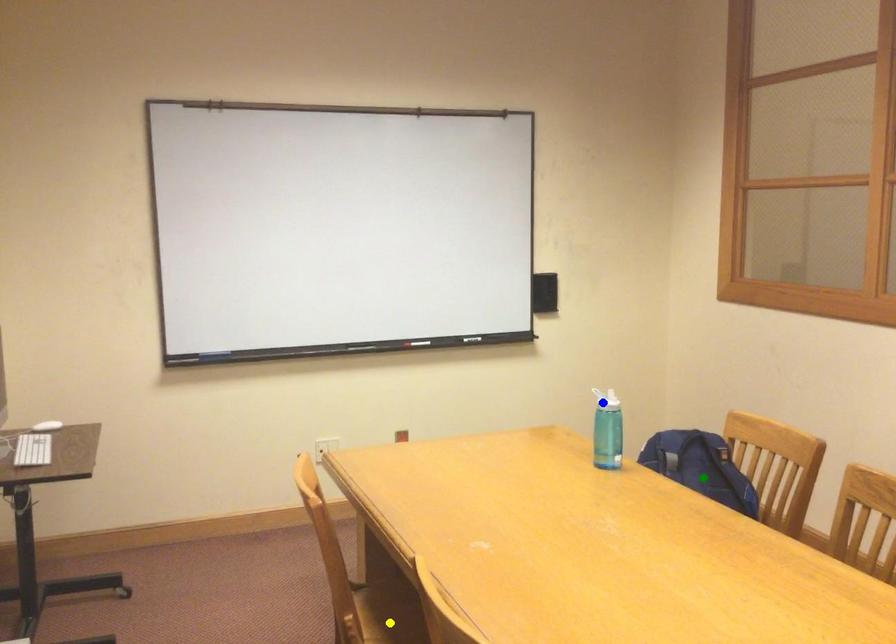
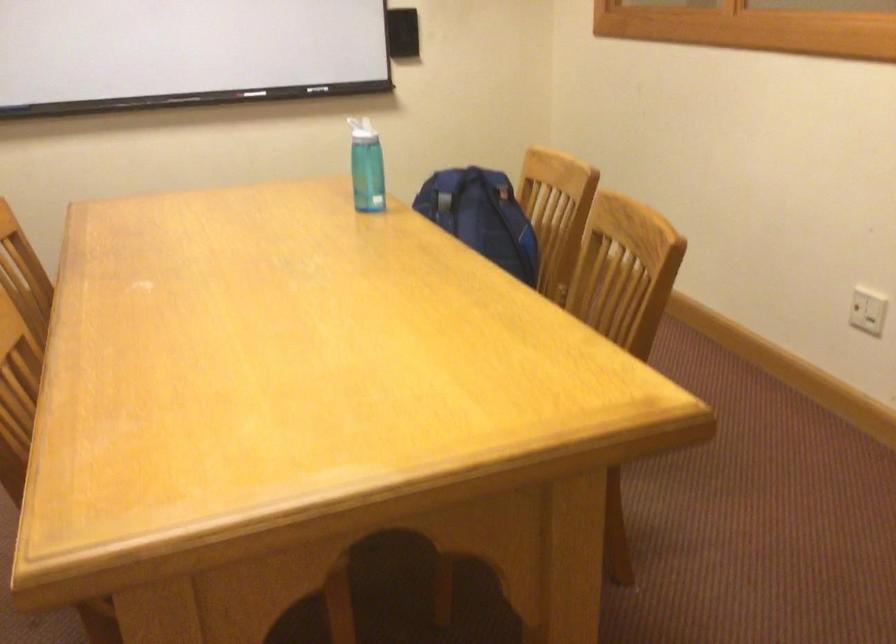
I am providing you with two images of the same scene from different viewpoints. Three points are marked in image1. Which point corresponds to a part or object that is occluded in image2?In image1, three points are marked. Which of them correspond to a part or object that is occluded in image2?Among the three points shown in image1, which one corresponds to a part or object that is no longer visible due to occlusion in image2?

yellow point